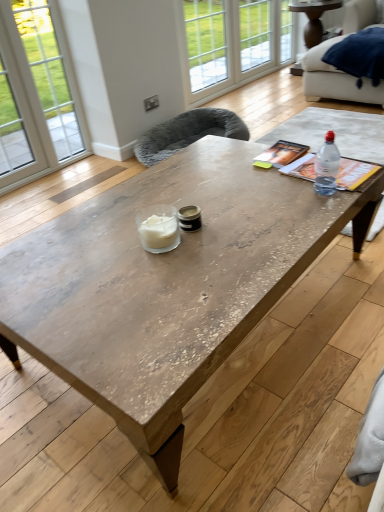
Describe the element at coordinates (206, 42) in the screenshot. This screenshot has width=384, height=512. I see `clear glass window at upper center, the 1th window viewed from the left` at that location.

Locate an element on the screen. The image size is (384, 512). clear glass window at upper center, the 1th window viewed from the left is located at coordinates (206, 42).

Considering the sizes of objects soft gray fabric armchair at center, arranged as the second armchair when viewed from the right, and clear glass window at upper center, which ranks as the second window in right-to-left order, in the image provided, who is thinner, soft gray fabric armchair at center, arranged as the second armchair when viewed from the right, or clear glass window at upper center, which ranks as the second window in right-to-left order,?

clear glass window at upper center, which ranks as the second window in right-to-left order.

From the picture: Would you say soft gray fabric armchair at center, the 1th armchair viewed from the left, contains clear glass window at upper center, the 2th window from the left?

No, soft gray fabric armchair at center, the 1th armchair viewed from the left, does not contain clear glass window at upper center, the 2th window from the left.

Can you confirm if soft gray fabric armchair at center, the 1th armchair viewed from the left, is bigger than clear glass window at upper center, which ranks as the second window in right-to-left order?

Yes, soft gray fabric armchair at center, the 1th armchair viewed from the left, is bigger than clear glass window at upper center, which ranks as the second window in right-to-left order.

In the scene shown: From a real-world perspective, which is physically below, soft gray fabric armchair at center, which is the first armchair in bottom-to-top order, or clear glass window at upper center, which ranks as the second window in right-to-left order?

From a 3D spatial view, soft gray fabric armchair at center, which is the first armchair in bottom-to-top order, is below.

Does point (335, 87) appear closer or farther from the camera than point (268, 36)?

Clearly, point (335, 87) is closer to the camera than point (268, 36).

Is velvet blue armchair at upper right, which is the first armchair in right-to-left order, further to camera compared to clear glass window at upper center, the 2th window from the left?

No, velvet blue armchair at upper right, which is the first armchair in right-to-left order, is in front of clear glass window at upper center, the 2th window from the left.

Is velvet blue armchair at upper right, the 2th armchair viewed from the left, inside the boundaries of clear glass window at upper center, which ranks as the second window in right-to-left order, or outside?

velvet blue armchair at upper right, the 2th armchair viewed from the left, exists outside the volume of clear glass window at upper center, which ranks as the second window in right-to-left order.

Who is smaller, velvet blue armchair at upper right, which is the first armchair in right-to-left order, or clear glass window at upper center, which ranks as the second window in right-to-left order?

clear glass window at upper center, which ranks as the second window in right-to-left order.

Which object is closer to the camera taking this photo, clear plastic bottle at upper right or soft gray fabric armchair at center, the 1th armchair viewed from the left?

Positioned in front is clear plastic bottle at upper right.

In the scene shown: Are clear plastic bottle at upper right and soft gray fabric armchair at center, which is the 2th armchair from top to bottom, far apart?

Indeed, clear plastic bottle at upper right is not near soft gray fabric armchair at center, which is the 2th armchair from top to bottom.

Looking at the image, does clear plastic bottle at upper right seem bigger or smaller compared to soft gray fabric armchair at center, the 1th armchair viewed from the left?

In the image, clear plastic bottle at upper right appears to be smaller than soft gray fabric armchair at center, the 1th armchair viewed from the left.

From a real-world perspective, which is physically above, clear plastic bottle at upper right or soft gray fabric armchair at center, which is the first armchair in bottom-to-top order?

clear plastic bottle at upper right.

Is soft gray fabric armchair at center, which is the first armchair in bottom-to-top order, touching clear glass window at upper center, the 3th window from the right?

soft gray fabric armchair at center, which is the first armchair in bottom-to-top order, and clear glass window at upper center, the 3th window from the right, are clearly separated.

Which object is positioned more to the left, soft gray fabric armchair at center, the 1th armchair viewed from the left, or clear glass window at upper center, the 3th window from the right?

Positioned to the left is soft gray fabric armchair at center, the 1th armchair viewed from the left.

Does soft gray fabric armchair at center, the 1th armchair viewed from the left, have a lesser width compared to clear glass window at upper center, the 1th window viewed from the left?

Incorrect, the width of soft gray fabric armchair at center, the 1th armchair viewed from the left, is not less than that of clear glass window at upper center, the 1th window viewed from the left.

Based on the photo, from a real-world perspective, which object rests below the other?

soft gray fabric armchair at center, the 1th armchair viewed from the left.

Between rustic wood coffee table at center and clear plastic bottle at upper right, which one appears on the right side from the viewer's perspective?

clear plastic bottle at upper right.

Does point (191, 385) appear closer or farther from the camera than point (328, 136)?

Point (191, 385) is positioned closer to the camera compared to point (328, 136).

From a real-world perspective, which is physically below, rustic wood coffee table at center or clear plastic bottle at upper right?

rustic wood coffee table at center.

Is rustic wood coffee table at center positioned beyond the bounds of clear plastic bottle at upper right?

rustic wood coffee table at center lies outside clear plastic bottle at upper right's area.

Based on their positions, is clear glass window at upper center, the 3th window from the right, located to the left or right of clear glass window at upper center, which ranks as the third window in left-to-right order?

clear glass window at upper center, the 3th window from the right, is positioned on clear glass window at upper center, which ranks as the third window in left-to-right order,'s left side.

Is clear glass window at upper center, the 1th window viewed from the left, wider than clear glass window at upper center, which ranks as the third window in left-to-right order?

Incorrect, the width of clear glass window at upper center, the 1th window viewed from the left, does not surpass that of clear glass window at upper center, which ranks as the third window in left-to-right order.

From the image's perspective, is clear glass window at upper center, the 1th window viewed from the left, on clear glass window at upper center, which appears as the first window when viewed from the right?

No, from the image's perspective, clear glass window at upper center, the 1th window viewed from the left, is not on top of clear glass window at upper center, which appears as the first window when viewed from the right.

Does clear glass window at upper center, the 1th window viewed from the left, lie in front of clear glass window at upper center, which appears as the first window when viewed from the right?

Yes.

Is clear glass window at upper center, the 2th window from the left, not within wooden side table at upper right?

Yes, clear glass window at upper center, the 2th window from the left, is located beyond the bounds of wooden side table at upper right.

Does clear glass window at upper center, which ranks as the second window in right-to-left order, touch wooden side table at upper right?

No, clear glass window at upper center, which ranks as the second window in right-to-left order, is not beside wooden side table at upper right.

How many degrees apart are the facing directions of clear glass window at upper center, the 2th window from the left, and wooden side table at upper right?

89.9 degrees separate the facing orientations of clear glass window at upper center, the 2th window from the left, and wooden side table at upper right.

Measure the distance between clear glass window at upper center, which ranks as the second window in right-to-left order, and wooden side table at upper right.

The distance of clear glass window at upper center, which ranks as the second window in right-to-left order, from wooden side table at upper right is 51.76 centimeters.

From a real-world perspective, which armchair is the 2nd one underneath the clear glass window at upper center, the 2th window from the left? Please provide its 2D coordinates.

[(188, 133)]

There is a velvet blue armchair at upper right, which is the first armchair in right-to-left order. Where is `the 2nd window above it (from the image's perspective)`? the 2nd window above it (from the image's perspective) is located at coordinates (254, 33).

Which object lies nearer to the anchor point clear plastic bottle at upper right, white glass door at upper center or clear glass window at upper center, the 3th window from the right?

Among the two, clear glass window at upper center, the 3th window from the right, is located nearer to clear plastic bottle at upper right.

Based on their spatial positions, is clear glass window at upper center, which appears as the first window when viewed from the right, or soft gray fabric armchair at center, which is the first armchair in bottom-to-top order, closer to wooden side table at upper right?

Based on the image, clear glass window at upper center, which appears as the first window when viewed from the right, appears to be nearer to wooden side table at upper right.

Considering their positions, is rustic wood coffee table at center positioned closer to white glass door at upper center than clear glass window at upper center, the 3th window from the right?

clear glass window at upper center, the 3th window from the right, lies closer to white glass door at upper center than the other object.

Estimate the real-world distances between objects in this image. Which object is further from white glass door at upper center, clear glass window at upper center, the 2th window from the left, or clear glass window at upper center, which appears as the first window when viewed from the right?

The object further to white glass door at upper center is clear glass window at upper center, which appears as the first window when viewed from the right.

From the image, which object appears to be nearer to white glass door at upper center, velvet blue armchair at upper right, the first armchair positioned from the top, or rustic wood coffee table at center?

velvet blue armchair at upper right, the first armchair positioned from the top.

Estimate the real-world distances between objects in this image. Which object is closer to wooden side table at upper right, rustic wood coffee table at center or clear glass window at upper center, the 1th window viewed from the left?

clear glass window at upper center, the 1th window viewed from the left, lies closer to wooden side table at upper right than the other object.

Estimate the real-world distances between objects in this image. Which object is further from soft gray fabric armchair at center, arranged as the second armchair when viewed from the right, clear glass window at upper center, which ranks as the third window in left-to-right order, or clear plastic bottle at upper right?

clear glass window at upper center, which ranks as the third window in left-to-right order, is positioned further to the anchor soft gray fabric armchair at center, arranged as the second armchair when viewed from the right.

Considering their positions, is clear glass window at upper center, the 3th window from the right, positioned closer to rustic wood coffee table at center than velvet blue armchair at upper right, the first armchair positioned from the top?

Based on the image, velvet blue armchair at upper right, the first armchair positioned from the top, appears to be nearer to rustic wood coffee table at center.

Locate an element on the screen. The width and height of the screenshot is (384, 512). glass door between clear glass window at upper center, which ranks as the second window in right-to-left order, and soft gray fabric armchair at center, the 1th armchair viewed from the left, in the vertical direction is located at coordinates (234, 42).

Locate an element on the screen. The height and width of the screenshot is (512, 384). glass door positioned between soft gray fabric armchair at center, which is the 2th armchair from top to bottom, and clear glass window at upper center, which appears as the first window when viewed from the right, from near to far is located at coordinates (234, 42).

Where is `window between clear glass window at upper center, which ranks as the second window in right-to-left order, and soft gray fabric armchair at center, the 1th armchair viewed from the left, in the vertical direction`? The width and height of the screenshot is (384, 512). window between clear glass window at upper center, which ranks as the second window in right-to-left order, and soft gray fabric armchair at center, the 1th armchair viewed from the left, in the vertical direction is located at coordinates (206, 42).

What are the coordinates of `glass door between clear glass window at upper center, the 1th window viewed from the left, and clear glass window at upper center, the 2th window from the left, in the front-back direction` in the screenshot? It's located at (234, 42).